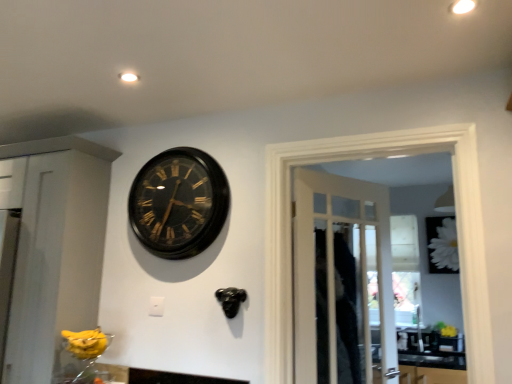
What do you see at coordinates (442, 245) in the screenshot?
I see `white matte flower at upper right` at bounding box center [442, 245].

The width and height of the screenshot is (512, 384). Find the location of `white glossy sink at lower right`. white glossy sink at lower right is located at coordinates (416, 337).

Where is `white matte flower at upper right`? white matte flower at upper right is located at coordinates (442, 245).

Considering the positions of points (296, 212) and (439, 244), is point (296, 212) farther from camera compared to point (439, 244)?

No, it is not.

In terms of size, does wooden door at center appear bigger or smaller than white matte flower at upper right?

wooden door at center is bigger than white matte flower at upper right.

Is wooden door at center not close to white matte flower at upper right?

Absolutely, wooden door at center is distant from white matte flower at upper right.

Is white matte flower at upper right inside wooden door at center?

No, white matte flower at upper right is located outside of wooden door at center.

Considering the sizes of white matte flower at upper right and wooden door at center in the image, is white matte flower at upper right taller or shorter than wooden door at center?

Considering their sizes, white matte flower at upper right has less height than wooden door at center.

Find the location of `door on the left side of white matte flower at upper right`. door on the left side of white matte flower at upper right is located at coordinates (342, 281).

From the image's perspective, is white matte flower at upper right positioned above or below wooden door at center?

Based on their image positions, white matte flower at upper right is located beneath wooden door at center.

Is black polished wood clock at upper center smaller than white matte flower at upper right?

No.

Can you confirm if black polished wood clock at upper center is positioned to the right of white matte flower at upper right?

No, black polished wood clock at upper center is not to the right of white matte flower at upper right.

Would you consider black polished wood clock at upper center to be distant from white matte flower at upper right?

Yes, black polished wood clock at upper center and white matte flower at upper right are located far from each other.

From the image's perspective, which object appears higher, black polished wood clock at upper center or white matte flower at upper right?

black polished wood clock at upper center, from the image's perspective.

From the image's perspective, is wooden door at center above or below white glossy sink at lower right?

wooden door at center is above white glossy sink at lower right.

From the picture: In the image, is wooden door at center positioned in front of or behind white glossy sink at lower right?

wooden door at center is in front of white glossy sink at lower right.

Between point (339, 370) and point (428, 340), which one is positioned behind?

Point (428, 340)

Would you consider wooden door at center to be distant from white glossy sink at lower right?

Yes, wooden door at center and white glossy sink at lower right are located far from each other.

Who is smaller, white glossy sink at lower right or wooden door at center?

With smaller size is white glossy sink at lower right.

Considering the positions of objects white glossy sink at lower right and wooden door at center in the image provided, who is more to the left, white glossy sink at lower right or wooden door at center?

From the viewer's perspective, wooden door at center appears more on the left side.

From the image's perspective, which one is positioned higher, white glossy sink at lower right or wooden door at center?

From the image's view, wooden door at center is above.

From the image's perspective, is white glossy sink at lower right under white matte flower at upper right?

Yes, from the image's perspective, white glossy sink at lower right is below white matte flower at upper right.

Does white glossy sink at lower right have a greater width compared to white matte flower at upper right?

Correct, the width of white glossy sink at lower right exceeds that of white matte flower at upper right.

Considering the sizes of white glossy sink at lower right and white matte flower at upper right in the image, is white glossy sink at lower right taller or shorter than white matte flower at upper right?

white glossy sink at lower right is shorter than white matte flower at upper right.

Considering the positions of objects white glossy sink at lower right and white matte flower at upper right in the image provided, who is more to the right, white glossy sink at lower right or white matte flower at upper right?

white matte flower at upper right is more to the right.

Relative to white glossy sink at lower right, is black polished wood clock at upper center in front or behind?

black polished wood clock at upper center is positioned closer to the viewer than white glossy sink at lower right.

Can you tell me how much black polished wood clock at upper center and white glossy sink at lower right differ in facing direction?

3.85 degrees.

Locate an element on the screen. Image resolution: width=512 pixels, height=384 pixels. sink that appears on the right of black polished wood clock at upper center is located at coordinates (416, 337).

Would you say black polished wood clock at upper center is outside white glossy sink at lower right?

Yes, black polished wood clock at upper center is not within white glossy sink at lower right.

Find the location of a particular element. door that is above the white matte flower at upper right (from the image's perspective) is located at coordinates (342, 281).

Identify the location of door located in front of the white matte flower at upper right. (342, 281).

Estimate the real-world distances between objects in this image. Which object is further from wooden door at center, black polished wood clock at upper center or white glossy sink at lower right?

white glossy sink at lower right lies further to wooden door at center than the other object.

Looking at the image, which one is located closer to black polished wood clock at upper center, wooden door at center or white matte flower at upper right?

Among the two, wooden door at center is located nearer to black polished wood clock at upper center.

Estimate the real-world distances between objects in this image. Which object is closer to white matte flower at upper right, wooden door at center or white glossy sink at lower right?

Based on the image, white glossy sink at lower right appears to be nearer to white matte flower at upper right.

Which object lies further to the anchor point white matte flower at upper right, white glossy sink at lower right or wooden door at center?

Among the two, wooden door at center is located further to white matte flower at upper right.

When comparing their distances from wooden door at center, does white glossy sink at lower right or white matte flower at upper right seem further?

white matte flower at upper right.

Looking at the image, which one is located closer to wooden door at center, white matte flower at upper right or white glossy sink at lower right?

The object closer to wooden door at center is white glossy sink at lower right.

Considering their positions, is wooden door at center positioned closer to white glossy sink at lower right than white matte flower at upper right?

white matte flower at upper right.

Based on their spatial positions, is black polished wood clock at upper center or wooden door at center further from white matte flower at upper right?

black polished wood clock at upper center lies further to white matte flower at upper right than the other object.

You are a GUI agent. You are given a task and a screenshot of the screen. Output one action in this format:
    pyautogui.click(x=<x>, y=<y>)
    Task: Click on the door located between black polished wood clock at upper center and white matte flower at upper right in the left-right direction
    
    Given the screenshot: What is the action you would take?
    pyautogui.click(x=342, y=281)

At what (x,y) coordinates should I click in order to perform the action: click on sink positioned between wooden door at center and white matte flower at upper right from near to far. Please return your answer as a coordinate pair (x, y). This screenshot has width=512, height=384. Looking at the image, I should click on (416, 337).

Find the location of `sink located between black polished wood clock at upper center and white matte flower at upper right in the left-right direction`. sink located between black polished wood clock at upper center and white matte flower at upper right in the left-right direction is located at coordinates (416, 337).

Where is `door between black polished wood clock at upper center and white glossy sink at lower right from left to right`? door between black polished wood clock at upper center and white glossy sink at lower right from left to right is located at coordinates (342, 281).